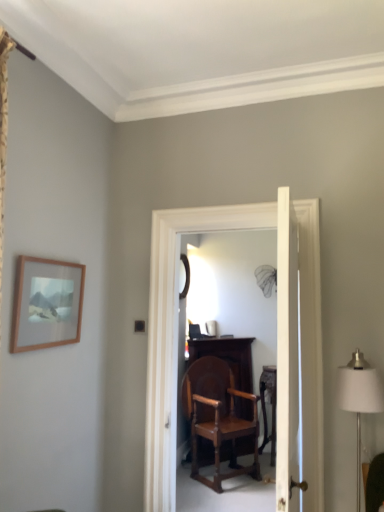
Question: Considering their positions, is black glass mirror at center located in front of or behind white smooth door at center?

Choices:
 (A) front
 (B) behind

Answer: (B)

Question: From the image's perspective, is black glass mirror at center located above or below white smooth door at center?

Choices:
 (A) above
 (B) below

Answer: (A)

Question: Which of these objects is positioned closest to the wooden table at center?

Choices:
 (A) white fabric lampshade at right
 (B) white smooth door at center
 (C) wooden chair at center
 (D) black glass mirror at center
 (E) wooden frame at upper left

Answer: (C)

Question: Which is farther from the wooden table at center?

Choices:
 (A) white smooth door at center
 (B) white fabric lampshade at right
 (C) wooden chair at center
 (D) wooden frame at upper left
 (E) black glass mirror at center

Answer: (D)